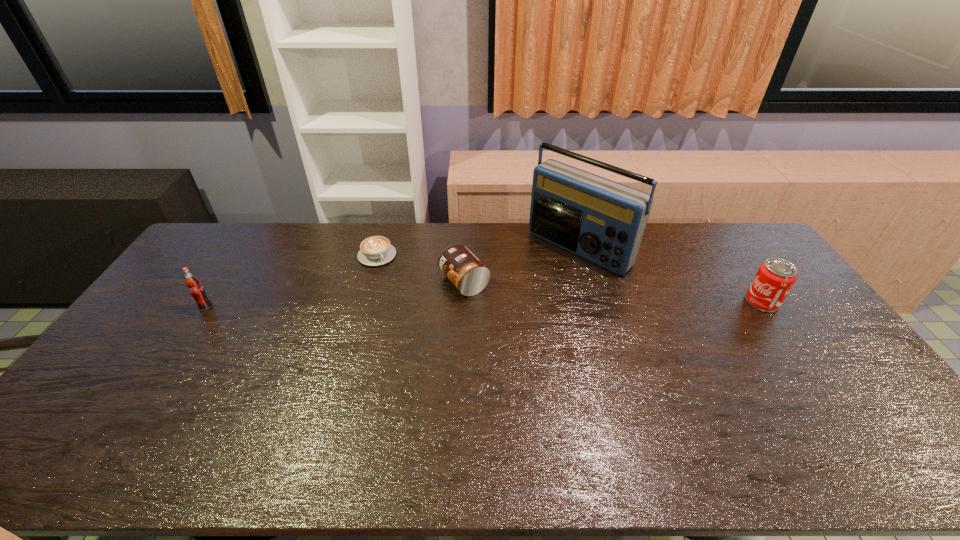
Select which object is the closest to the taller can. Please provide its 2D coordinates. Your answer should be formatted as a tuple, i.e. [(x, y)], where the tuple contains the x and y coordinates of a point satisfying the conditions above.

[(603, 221)]

You are a GUI agent. You are given a task and a screenshot of the screen. Output one action in this format:
    pyautogui.click(x=<x>, y=<y>)
    Task: Click on the vacant space that satisfies the following two spatial constraints: 1. on the front side of the left can; 2. on the left side of the shortest object
    This screenshot has width=960, height=540.
    Given the screenshot: What is the action you would take?
    pyautogui.click(x=370, y=282)